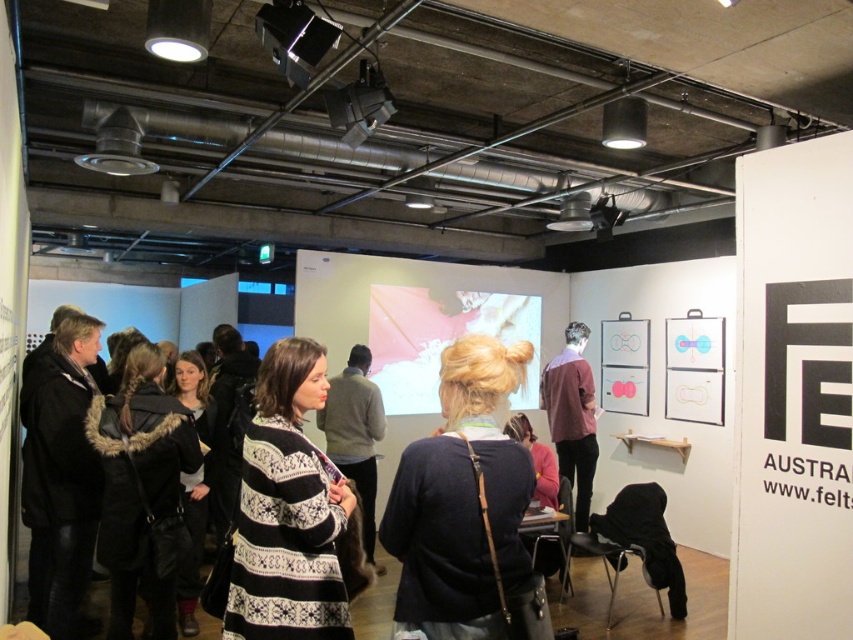
You are an event organizer who needs to arrange seating for a presentation. You notice two sweaters in the image, the striped sweater at center and the maroon sweater at center. Which sweater is positioned lower in the image?

The striped sweater at center is below the maroon sweater at center, so the striped sweater at center is positioned lower in the image.